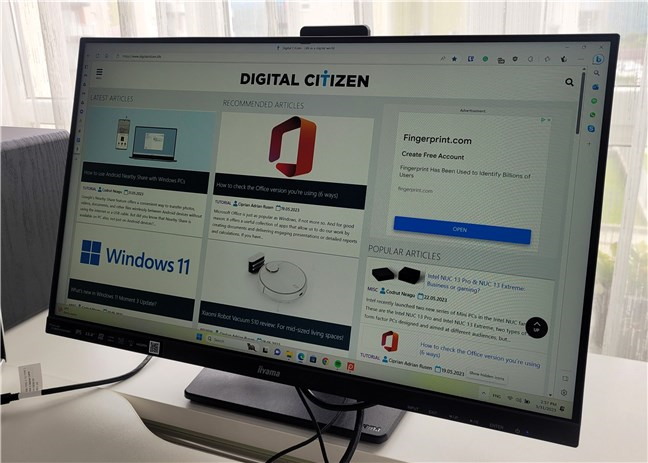
Where is `monitor base`? The height and width of the screenshot is (463, 648). monitor base is located at coordinates (260, 398).